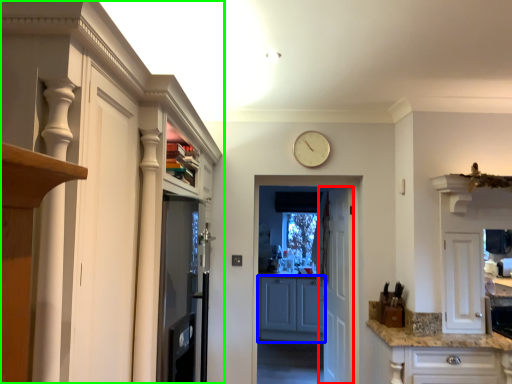
Question: Considering the real-world distances, which object is farthest from door (highlighted by a red box)? cabinetry (highlighted by a blue box) or cabinetry (highlighted by a green box)?

Choices:
 (A) cabinetry
 (B) cabinetry

Answer: (B)